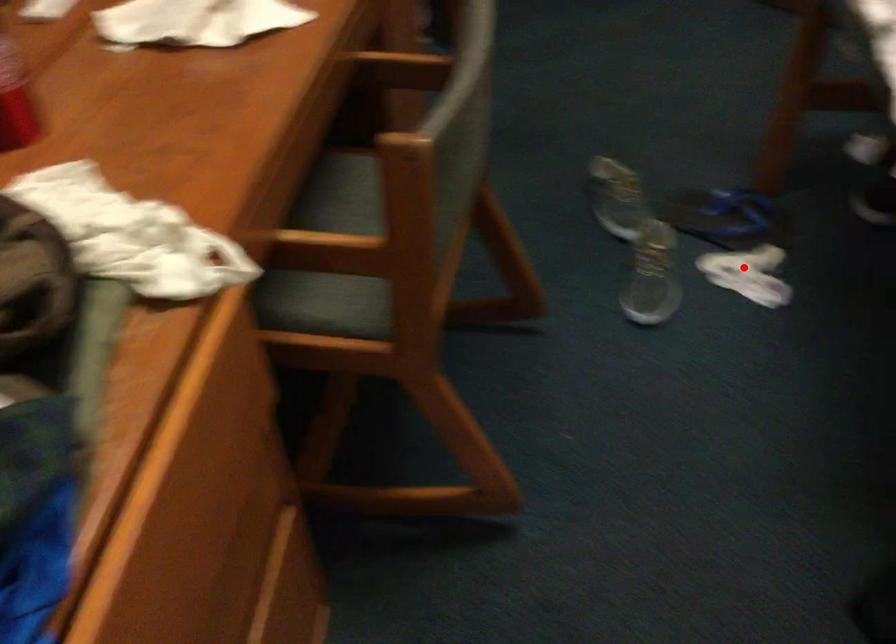
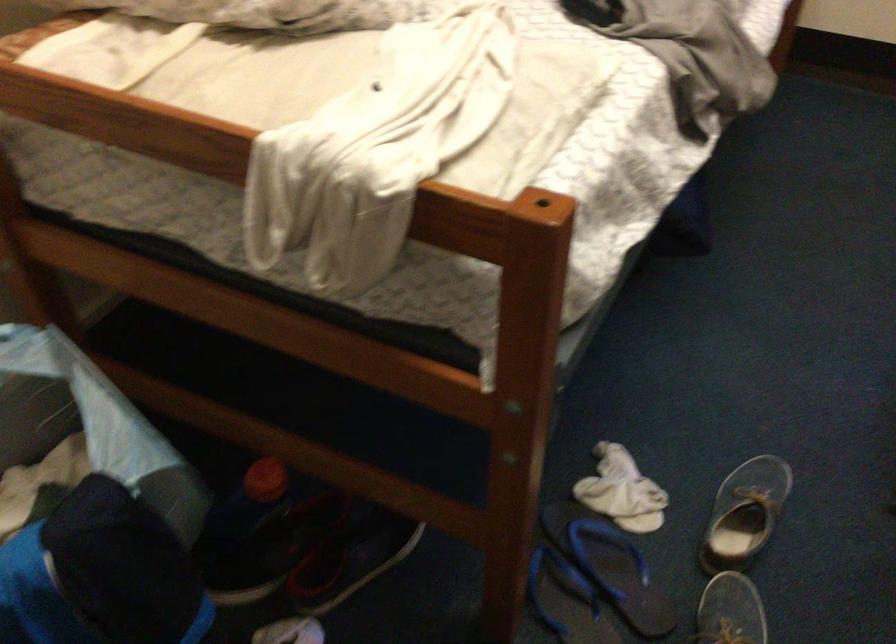
Where in the second image is the point corresponding to the highlighted location from the first image?

(622, 491)